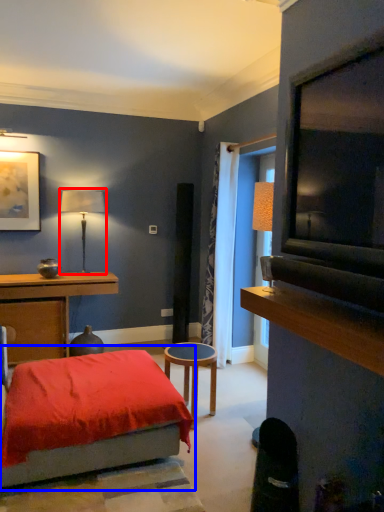
Question: Which object appears farthest to the camera in this image, table lamp (highlighted by a red box) or bed (highlighted by a blue box)?

Choices:
 (A) table lamp
 (B) bed

Answer: (A)